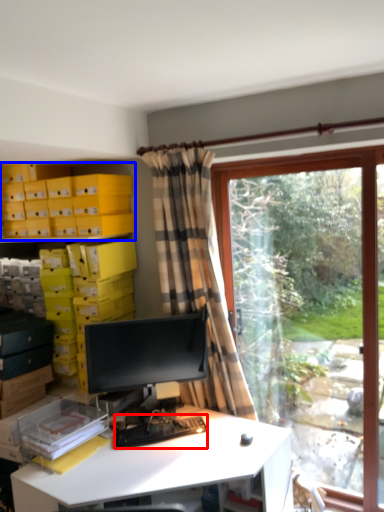
Question: Which of the following is the closest to the observer, computer keyboard (highlighted by a red box) or shelf (highlighted by a blue box)?

Choices:
 (A) computer keyboard
 (B) shelf

Answer: (A)